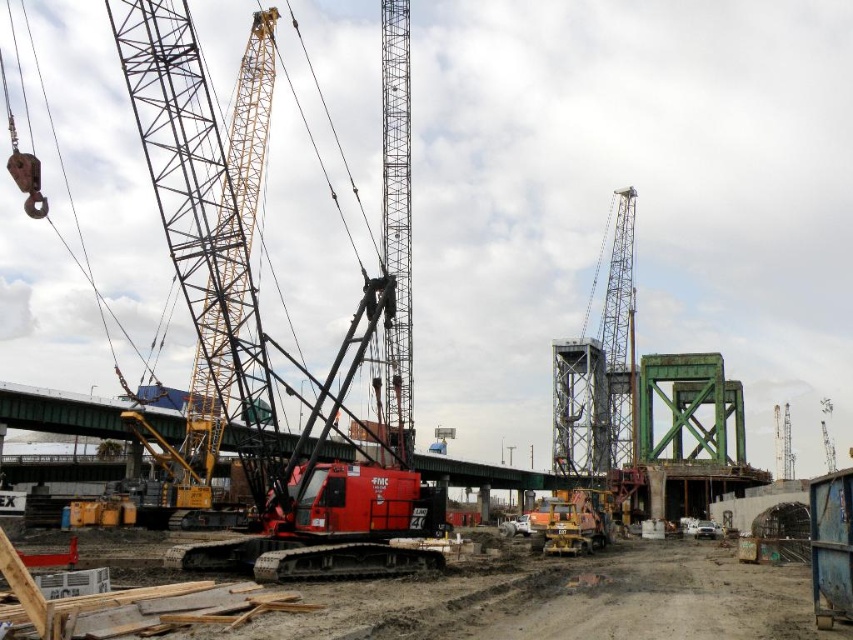
You are a construction worker standing at the center of the construction site. You need to determine the order of two points marked on your map to plan the safest path for heavy machinery. Which point is closer to you, point (258,365) or point (784,445)?

Point (258,365) is in front of point (784,445), so it is closer to you.

You are a construction worker standing at the entrance of the construction site. You need to move a heavy beam from the yellow metallic crane at left to the metallic gray crane at center. Which crane should you move the beam to first?

The yellow metallic crane at left is in front of the metallic gray crane at center, so you should move the beam to the yellow metallic crane at left first as it is closer to your current position at the entrance.